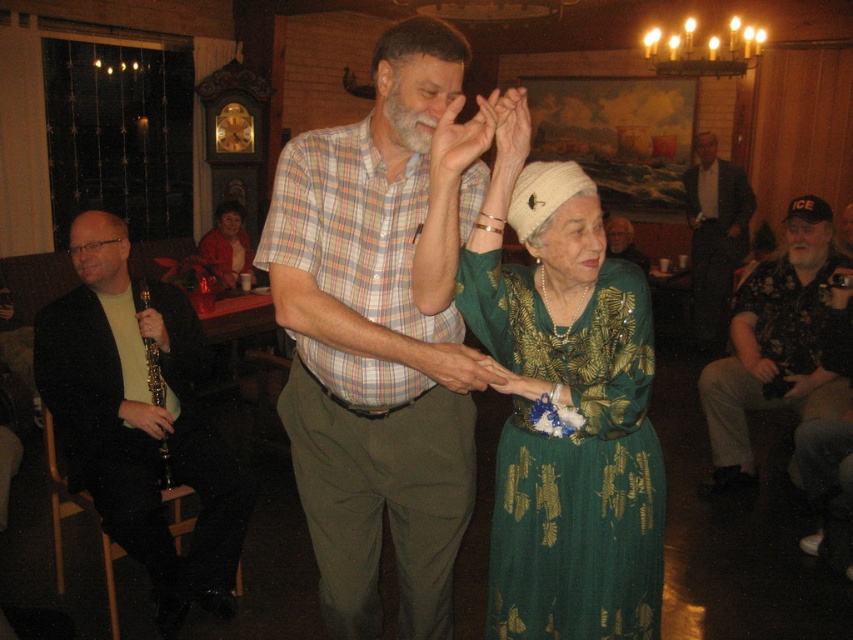
Question: Can you confirm if black matte clarinet at left is bigger than black floral shirt at right?

Choices:
 (A) no
 (B) yes

Answer: (B)

Question: Which object appears farthest from the camera in this image?

Choices:
 (A) green textured dress at center
 (B) black floral shirt at right
 (C) gray hair at center

Answer: (C)

Question: Is green textured dress at center further to camera compared to black wood clarinet at left?

Choices:
 (A) no
 (B) yes

Answer: (A)

Question: Which object is closer to the camera taking this photo?

Choices:
 (A) black floral shirt at right
 (B) black matte clarinet at left
 (C) black wood clarinet at left

Answer: (B)

Question: Is black matte clarinet at left smaller than black wood clarinet at left?

Choices:
 (A) yes
 (B) no

Answer: (B)

Question: Which of the following is the farthest from the observer?

Choices:
 (A) (161, 400)
 (B) (759, 381)

Answer: (B)